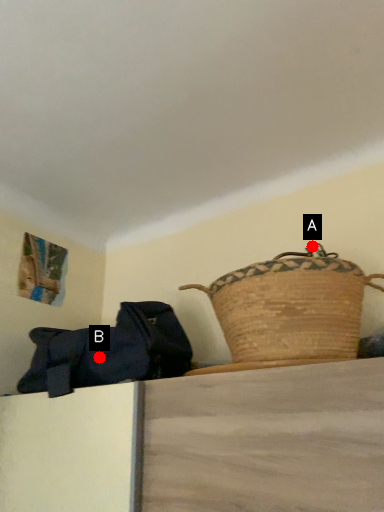
Question: Two points are circled on the image, labeled by A and B beside each circle. Which point is further to the camera?

Choices:
 (A) A is further
 (B) B is further

Answer: (B)